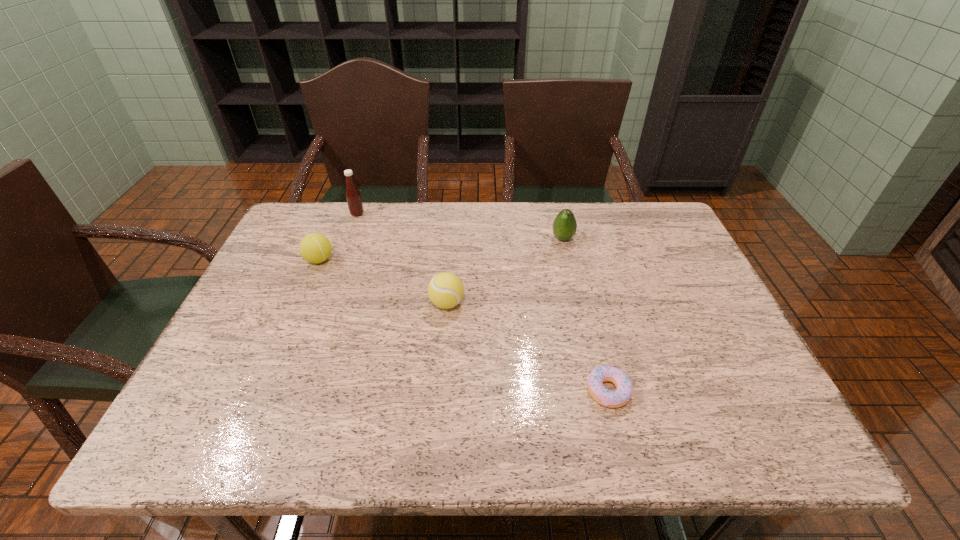
Find the location of a particular element. Image resolution: width=960 pixels, height=540 pixels. vacant position located 0.150m on the right of the avocado is located at coordinates click(x=625, y=239).

This screenshot has height=540, width=960. I want to click on vacant space located on the right of the nearer tennis ball, so click(x=548, y=303).

You are a GUI agent. You are given a task and a screenshot of the screen. Output one action in this format:
    pyautogui.click(x=<x>, y=<y>)
    Task: Click on the free space located 0.310m on the right of the left tennis ball
    The image size is (960, 540).
    Given the screenshot: What is the action you would take?
    pyautogui.click(x=444, y=260)

Where is `vacant region located on the back of the shortest object`? Image resolution: width=960 pixels, height=540 pixels. vacant region located on the back of the shortest object is located at coordinates (588, 312).

I want to click on Tabasco sauce that is at the far edge, so click(353, 196).

Find the location of a particular element. avocado that is at the far edge is located at coordinates (564, 227).

Identify the location of object located in the near edge section of the desktop. [x=620, y=397].

Where is `object that is at the left edge`? The height and width of the screenshot is (540, 960). object that is at the left edge is located at coordinates (315, 248).

The height and width of the screenshot is (540, 960). Identify the location of vacant space at the far edge of the desktop. coord(481,236).

Locate an element on the screen. The image size is (960, 540). vacant region at the near edge of the desktop is located at coordinates (304, 421).